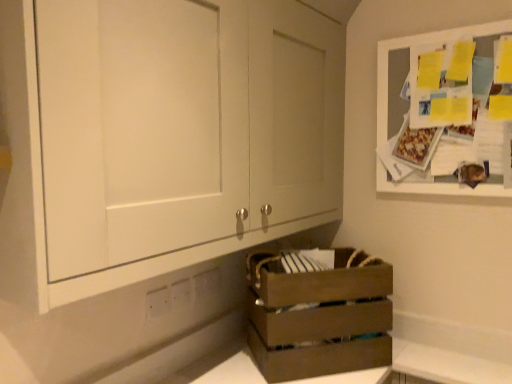
Question: From the image's perspective, is white plastic electric outlet at lower center, placed as the 3th electric outlet when sorted from front to back, positioned above or below white plastic electric outlet at lower center, the 1th electric outlet viewed from the left?

Choices:
 (A) below
 (B) above

Answer: (B)

Question: Is point (197, 279) positioned closer to the camera than point (163, 306)?

Choices:
 (A) closer
 (B) farther

Answer: (B)

Question: Estimate the real-world distances between objects in this image. Which object is closer to the brown wooden crate at lower center?

Choices:
 (A) white plastic electric outlet at lower center, which is the third electric outlet from back to front
 (B) white plastic electric outlet at lower center, which is the 2th electric outlet from front to back
 (C) matte white cabinet at center, placed as the second cabinetry when sorted from right to left
 (D) white plastic electric outlet at lower center, placed as the 1th electric outlet when sorted from right to left
 (E) white wood board at upper right, which is the 1th cabinetry in right-to-left order

Answer: (D)

Question: Which object is the closest to the brown wooden crate at lower center?

Choices:
 (A) white plastic electric outlet at lower center, the 1th electric outlet viewed from the left
 (B) white plastic electric outlet at lower center, which is the 3th electric outlet in left-to-right order
 (C) matte white cabinet at center, the 1th cabinetry in the left-to-right sequence
 (D) white plastic electric outlet at lower center, which is the 2th electric outlet from front to back
 (E) white wood board at upper right, the 2th cabinetry when ordered from left to right

Answer: (B)